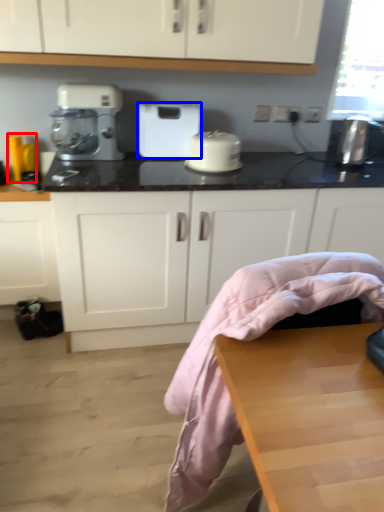
Question: Which of the following is the farthest to the observer, appliance (highlighted by a red box) or home appliance (highlighted by a blue box)?

Choices:
 (A) appliance
 (B) home appliance

Answer: (A)